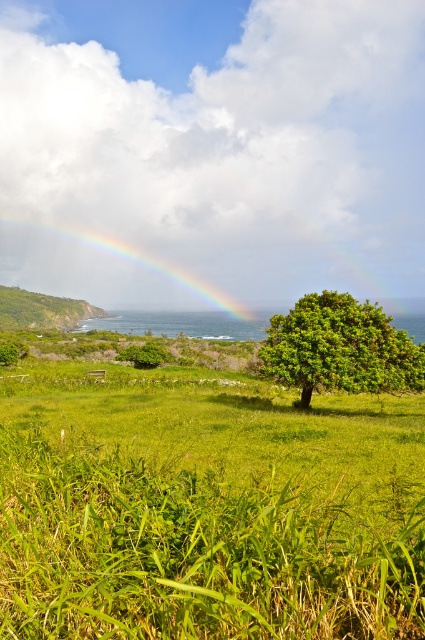
From the picture: Which is below, rainbow at center or green grassy hillside at left?

green grassy hillside at left is below.

Does rainbow at center appear on the left side of green grassy hillside at left?

Incorrect, rainbow at center is not on the left side of green grassy hillside at left.

Is point (200, 289) closer to viewer compared to point (28, 301)?

No, it is not.

You are a GUI agent. You are given a task and a screenshot of the screen. Output one action in this format:
    pyautogui.click(x=<x>, y=<y>)
    Task: Click on the rainbow at center
    This screenshot has width=425, height=640.
    Given the screenshot: What is the action you would take?
    pyautogui.click(x=121, y=269)

Is green leafy tree at center wider than rainbow at center?

No, green leafy tree at center is not wider than rainbow at center.

Is the position of green leafy tree at center less distant than that of rainbow at center?

Yes, it is in front of rainbow at center.

This screenshot has height=640, width=425. What do you see at coordinates (340, 348) in the screenshot?
I see `green leafy tree at center` at bounding box center [340, 348].

You are a GUI agent. You are given a task and a screenshot of the screen. Output one action in this format:
    pyautogui.click(x=<x>, y=<y>)
    Task: Click on the green leafy tree at center
    
    Given the screenshot: What is the action you would take?
    pyautogui.click(x=340, y=348)

Which is more to the left, green leafy tree at center or green grassy hillside at left?

green grassy hillside at left is more to the left.

Describe the element at coordinates (340, 348) in the screenshot. I see `green leafy tree at center` at that location.

This screenshot has width=425, height=640. What are the coordinates of `green leafy tree at center` in the screenshot? It's located at (340, 348).